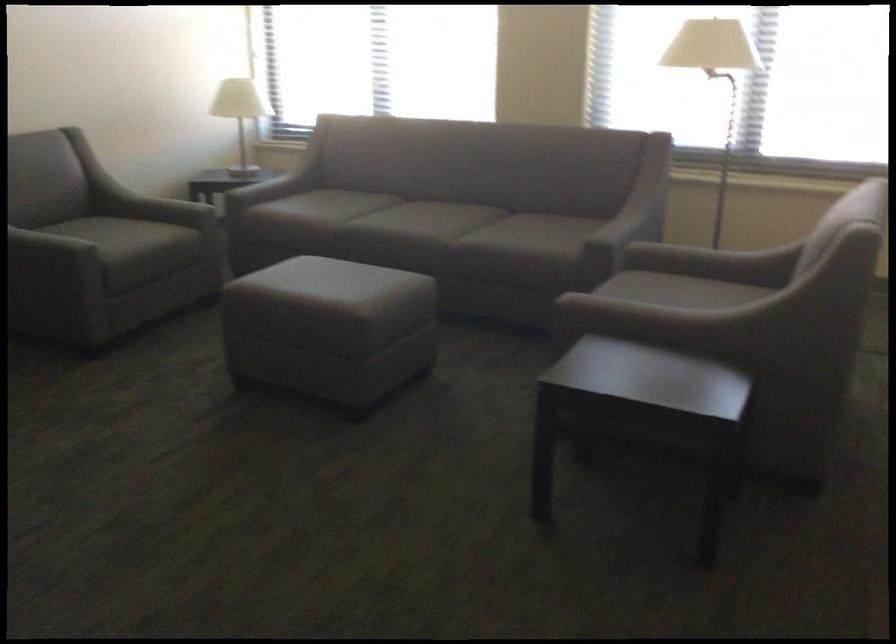
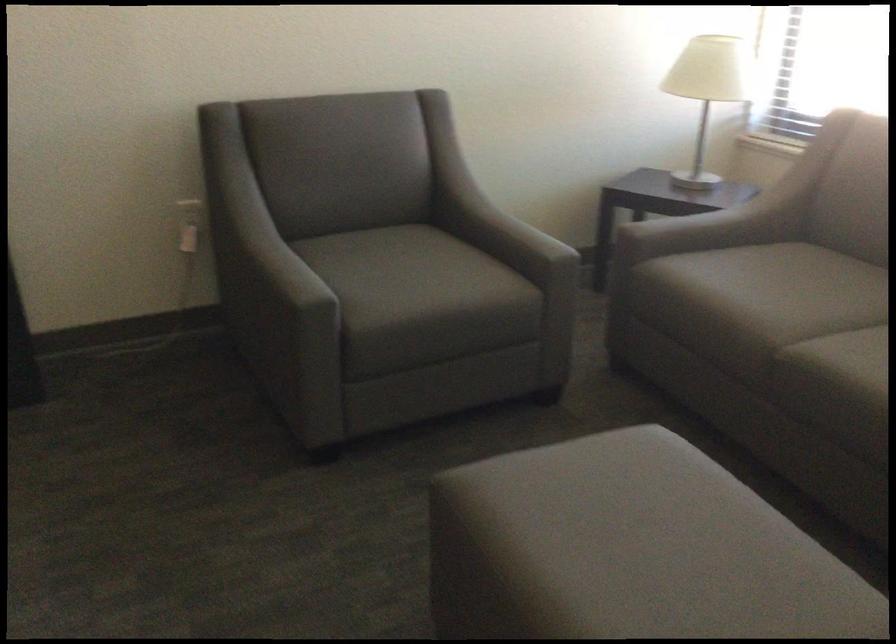
In the second image, find the point that corresponds to (x=340, y=202) in the first image.

(797, 292)